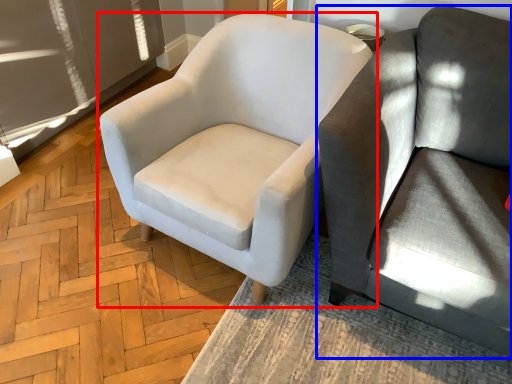
Question: Which object is further to the camera taking this photo, chair (highlighted by a red box) or studio couch (highlighted by a blue box)?

Choices:
 (A) chair
 (B) studio couch

Answer: (A)